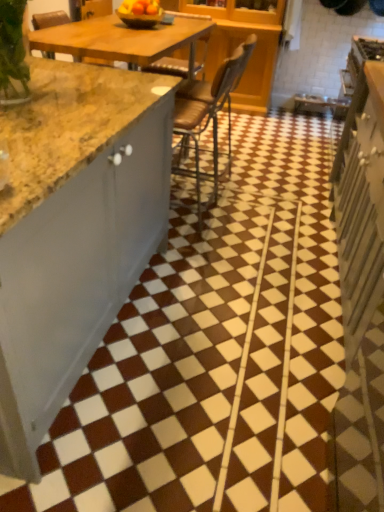
The width and height of the screenshot is (384, 512). I want to click on brown leather chair at center, so click(x=208, y=115).

Identify the location of brown glossy tile at center. tap(215, 352).

Describe the element at coordinates (215, 352) in the screenshot. The height and width of the screenshot is (512, 384). I see `brown glossy tile at center` at that location.

Describe the element at coordinates (361, 205) in the screenshot. I see `white glossy cabinet at right` at that location.

Describe the element at coordinates (140, 16) in the screenshot. I see `matte yellow bowl at upper center` at that location.

Locate an element on the screen. Image resolution: width=384 pixels, height=512 pixels. brown leather chair at center is located at coordinates (208, 115).

Is matte yellow bowl at upper center behind white glossy cabinet at right?

Yes, matte yellow bowl at upper center is behind white glossy cabinet at right.

In the scene shown: Is matte yellow bowl at upper center to the left or to the right of white glossy cabinet at right in the image?

From the image, it's evident that matte yellow bowl at upper center is to the left of white glossy cabinet at right.

Locate an element on the screen. bowl that is above the white glossy cabinet at right (from the image's perspective) is located at coordinates (140, 16).

Looking at this image, considering the sizes of objects matte yellow bowl at upper center and white glossy cabinet at right in the image provided, who is smaller, matte yellow bowl at upper center or white glossy cabinet at right?

Smaller between the two is matte yellow bowl at upper center.

Could you tell me if brown glossy tile at center is turned towards brown leather chair at center?

No, brown glossy tile at center is not turned towards brown leather chair at center.

Is point (216, 283) farther from camera compared to point (198, 121)?

That is False.

In the scene shown: Is there a large distance between brown glossy tile at center and brown leather chair at center?

brown glossy tile at center is near brown leather chair at center, not far away.

Is brown leather chair at center spatially inside white glossy cabinet at right, or outside of it?

The correct answer is: outside.

Does point (187, 105) come farther from viewer compared to point (352, 294)?

Yes, it is behind point (352, 294).

Which of these two, matte yellow bowl at upper center or brown glossy tile at center, is wider?

brown glossy tile at center is wider.

From the image's perspective, which object appears higher, matte yellow bowl at upper center or brown glossy tile at center?

From the image's view, matte yellow bowl at upper center is above.

Is matte yellow bowl at upper center situated inside brown glossy tile at center or outside?

matte yellow bowl at upper center is not inside brown glossy tile at center, it's outside.

From the image's perspective, is white glossy cabinet at right on top of brown glossy tile at center?

No, from the image's perspective, white glossy cabinet at right is not over brown glossy tile at center.

Which object is further away from the camera taking this photo, white glossy cabinet at right or brown glossy tile at center?

brown glossy tile at center is further away from the camera.

Consider the image. From a real-world perspective, which object stands above the other?

white glossy cabinet at right.

From their relative heights in the image, would you say white glossy cabinet at right is taller or shorter than brown glossy tile at center?

Clearly, white glossy cabinet at right is taller compared to brown glossy tile at center.

From the image's perspective, is brown leather chair at center positioned above or below brown glossy tile at center?

brown leather chair at center is above brown glossy tile at center.

Considering the relative positions of brown leather chair at center and brown glossy tile at center in the image provided, is brown leather chair at center to the right of brown glossy tile at center from the viewer's perspective?

Yes, brown leather chair at center is to the right of brown glossy tile at center.

In terms of height, does brown leather chair at center look taller or shorter compared to brown glossy tile at center?

In the image, brown leather chair at center appears to be taller than brown glossy tile at center.

Considering the relative sizes of brown glossy tile at center and matte yellow bowl at upper center in the image provided, is brown glossy tile at center taller than matte yellow bowl at upper center?

Correct, brown glossy tile at center is much taller as matte yellow bowl at upper center.

Does brown glossy tile at center have a smaller size compared to matte yellow bowl at upper center?

Actually, brown glossy tile at center might be larger than matte yellow bowl at upper center.

Could matte yellow bowl at upper center be considered to be inside brown glossy tile at center?

No, matte yellow bowl at upper center is not a part of brown glossy tile at center.

Is brown glossy tile at center positioned with its back to matte yellow bowl at upper center?

brown glossy tile at center does not have its back to matte yellow bowl at upper center.

You are a GUI agent. You are given a task and a screenshot of the screen. Output one action in this format:
    pyautogui.click(x=<x>, y=<y>)
    Task: Click on the bowl positioned vertically above the white glossy cabinet at right (from a real-world perspective)
    This screenshot has height=512, width=384.
    Given the screenshot: What is the action you would take?
    pyautogui.click(x=140, y=16)

Find the location of a particular element. This screenshot has height=512, width=384. chair that appears above the brown glossy tile at center (from the image's perspective) is located at coordinates (208, 115).

Estimate the real-world distances between objects in this image. Which object is further from brown leather chair at center, white glossy cabinet at right or brown glossy tile at center?

white glossy cabinet at right lies further to brown leather chair at center than the other object.

From the image, which object appears to be nearer to matte yellow bowl at upper center, white glossy cabinet at right or brown leather chair at center?

Among the two, brown leather chair at center is located nearer to matte yellow bowl at upper center.

Estimate the real-world distances between objects in this image. Which object is closer to brown leather chair at center, matte yellow bowl at upper center or brown glossy tile at center?

Among the two, brown glossy tile at center is located nearer to brown leather chair at center.

Based on the photo, looking at the image, which one is located further to matte yellow bowl at upper center, brown leather chair at center or white glossy cabinet at right?

The object further to matte yellow bowl at upper center is white glossy cabinet at right.

When comparing their distances from matte yellow bowl at upper center, does white glossy cabinet at right or brown glossy tile at center seem closer?

white glossy cabinet at right is positioned closer to the anchor matte yellow bowl at upper center.

Looking at the image, which one is located further to brown glossy tile at center, matte yellow bowl at upper center or white glossy cabinet at right?

matte yellow bowl at upper center.

When comparing their distances from white glossy cabinet at right, does matte yellow bowl at upper center or brown glossy tile at center seem closer?

brown glossy tile at center is closer to white glossy cabinet at right.

From the image, which object appears to be nearer to brown glossy tile at center, white glossy cabinet at right or brown leather chair at center?

Among the two, white glossy cabinet at right is located nearer to brown glossy tile at center.

What are the coordinates of `tile located between white glossy cabinet at right and matte yellow bowl at upper center in the depth direction` in the screenshot? It's located at (215, 352).

Locate an element on the screen. tile between white glossy cabinet at right and brown leather chair at center along the z-axis is located at coordinates (215, 352).

Find the location of a particular element. chair between white glossy cabinet at right and matte yellow bowl at upper center in the front-back direction is located at coordinates (208, 115).

This screenshot has height=512, width=384. I want to click on chair positioned between brown glossy tile at center and matte yellow bowl at upper center from near to far, so click(208, 115).